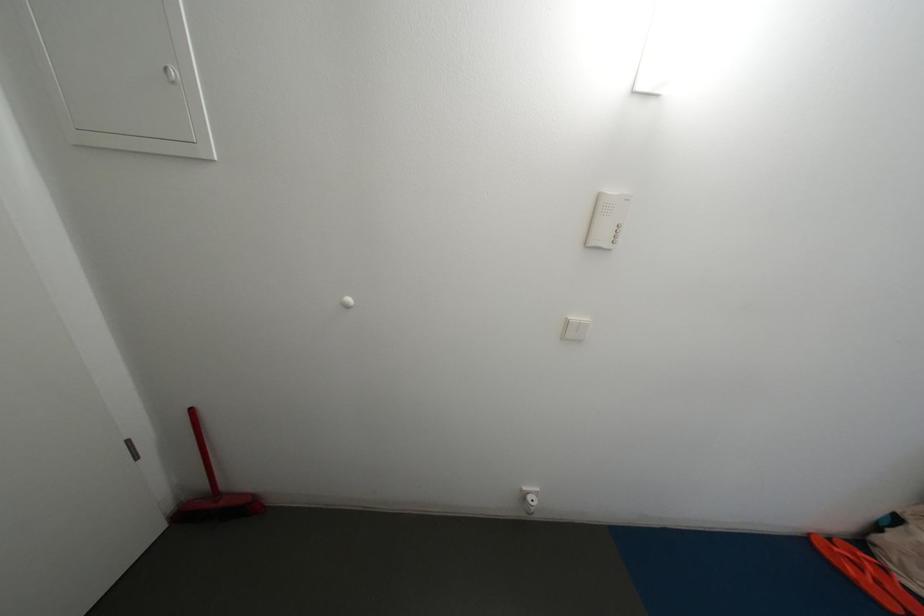
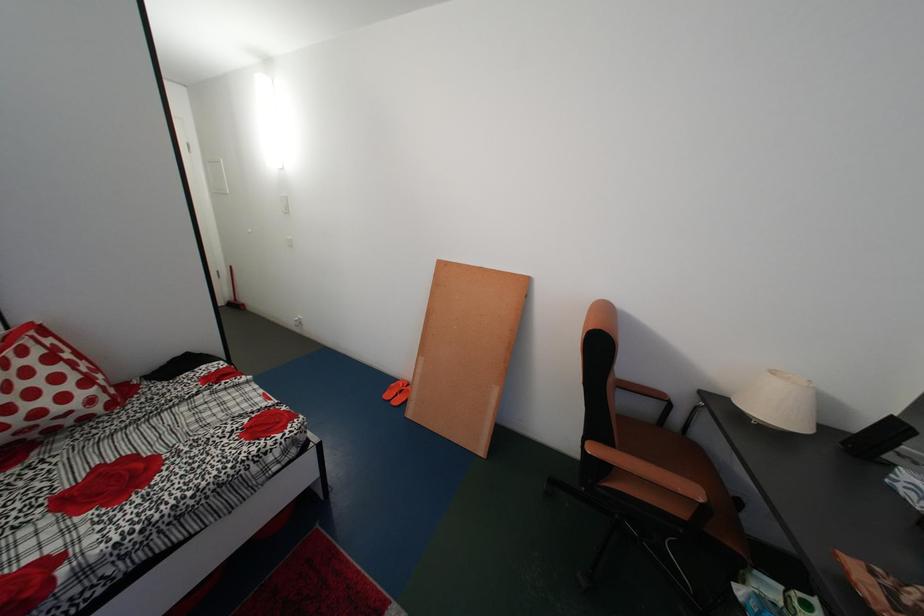
Question: In a continuous first-person perspective shot, in which direction is the camera moving?

Choices:
 (A) Left
 (B) Right
 (C) Forward
 (D) Backward

Answer: (B)